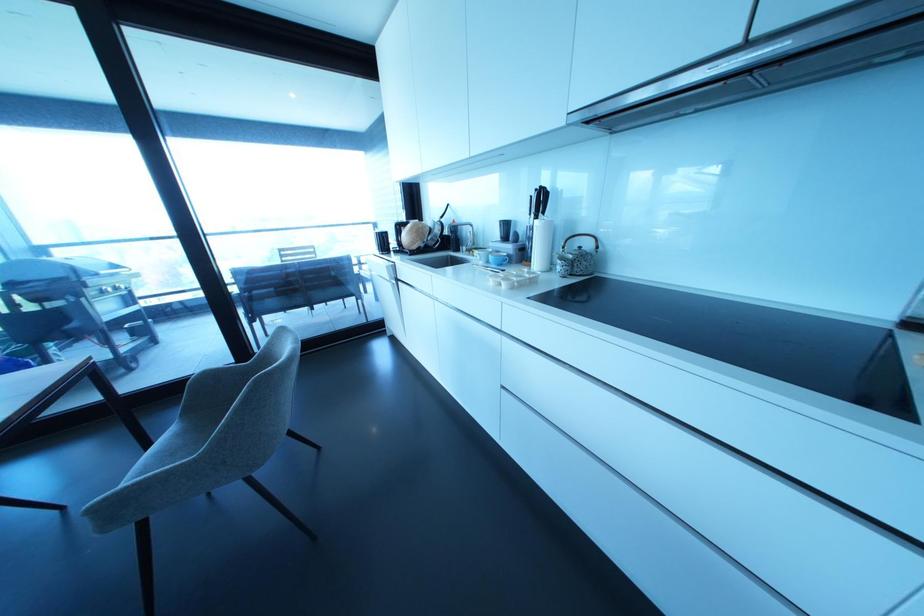
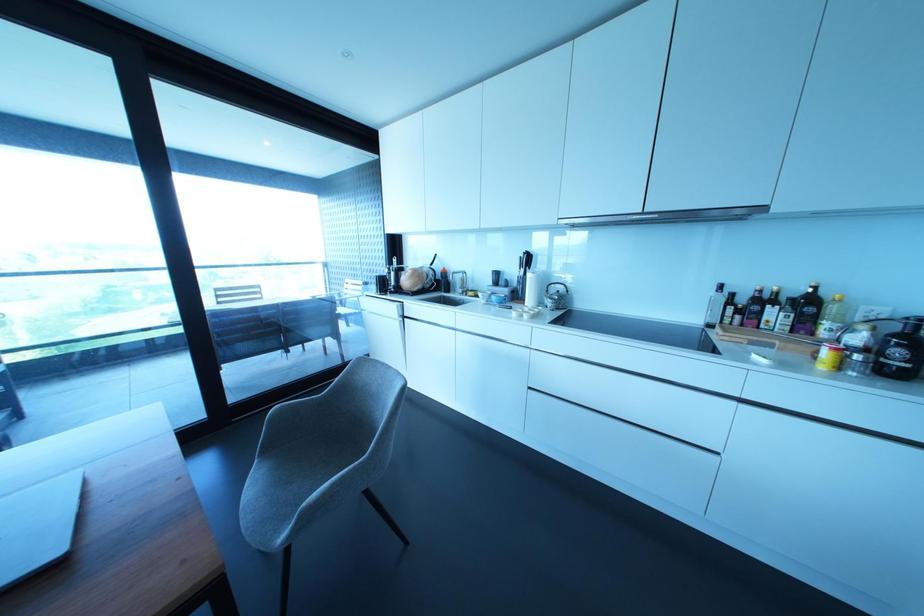
Question: Based on the continuous images, in which direction is the camera rotating? Reply with the corresponding letter.

Choices:
 (A) Left
 (B) Right
 (C) Up
 (D) Down

Answer: (B)